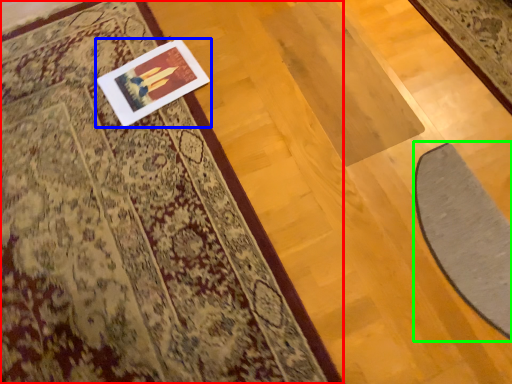
Question: Which object is positioned closest to mat (highlighted by a red box)? Select from picture frame (highlighted by a blue box) and doormat (highlighted by a green box).

Choices:
 (A) picture frame
 (B) doormat

Answer: (A)